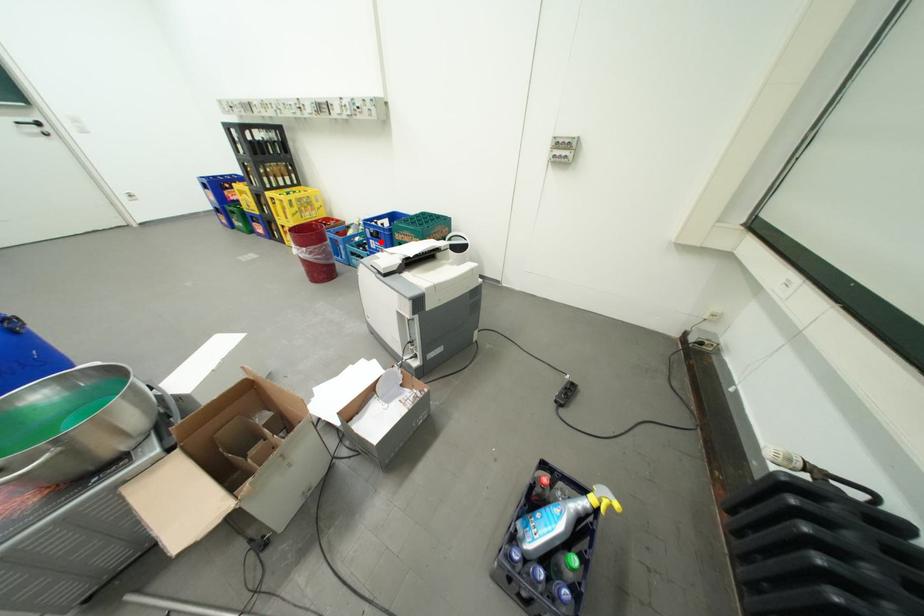
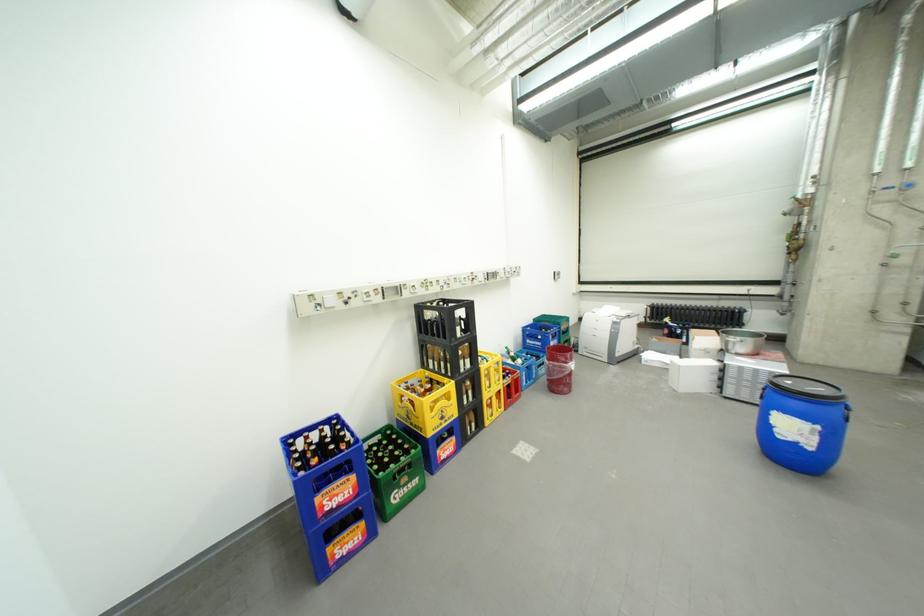
Find the pixel in the second image that matches the highlighted location in the first image.

(562, 344)